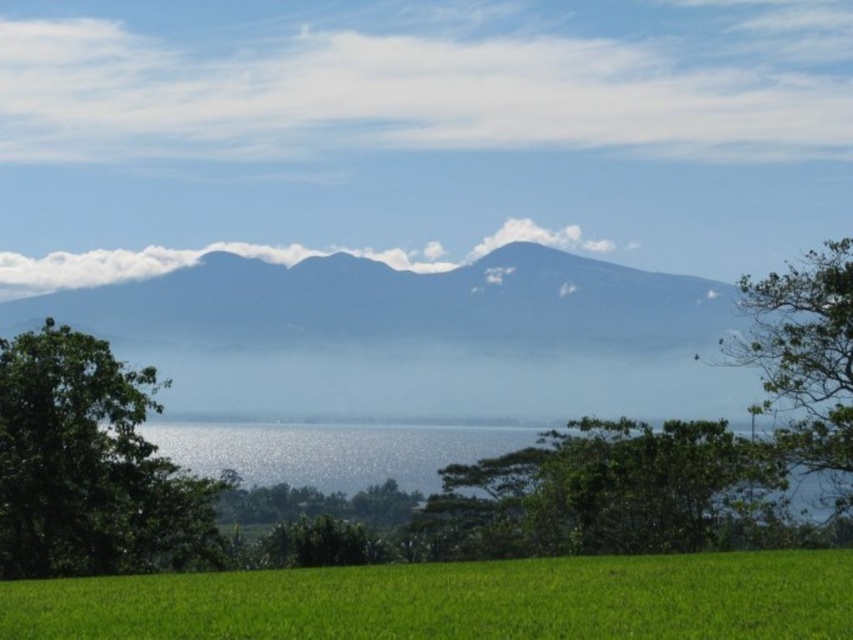
You are a hiker standing at the edge of the green field and want to take a photo of both the green leafy tree at left and the green leafy tree at center. Which tree should you position closer to in order to capture both in the frame without moving the camera?

The green leafy tree at left is taller than the green leafy tree at center. To capture both in the frame without moving the camera, you should position yourself closer to the shorter green leafy tree at center. This way, the distance between the trees will appear smaller, allowing both to fit within the camera frame.

You are standing at the center of the image and want to walk towards the green grassy field at lower center. In which direction should you move?

You should move downward because the green grassy field at lower center is located at point (x=457, y=600), which is below your current position at the center.